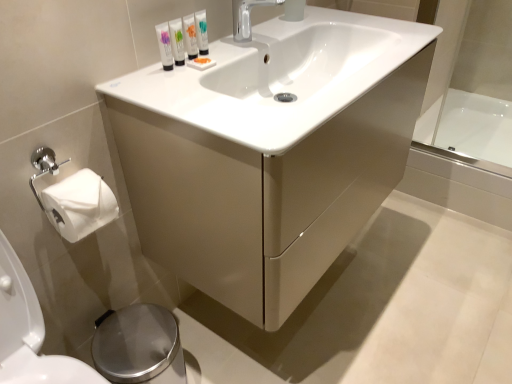
Question: Considering the relative sizes of polished stainless steel bidet at lower left and white glossy bathtub at right in the image provided, is polished stainless steel bidet at lower left taller than white glossy bathtub at right?

Choices:
 (A) yes
 (B) no

Answer: (A)

Question: Is polished stainless steel bidet at lower left closer to the viewer compared to white glossy bathtub at right?

Choices:
 (A) no
 (B) yes

Answer: (B)

Question: Is polished stainless steel bidet at lower left to the right of white glossy bathtub at right from the viewer's perspective?

Choices:
 (A) no
 (B) yes

Answer: (A)

Question: Does polished stainless steel bidet at lower left have a lesser width compared to white glossy bathtub at right?

Choices:
 (A) no
 (B) yes

Answer: (B)

Question: Does polished stainless steel bidet at lower left have a smaller size compared to white glossy bathtub at right?

Choices:
 (A) yes
 (B) no

Answer: (A)

Question: Is polished stainless steel bidet at lower left shorter than white glossy bathtub at right?

Choices:
 (A) yes
 (B) no

Answer: (B)

Question: Is matte white cabinet at center shorter than white glossy bathtub at right?

Choices:
 (A) no
 (B) yes

Answer: (A)

Question: From a real-world perspective, is matte white cabinet at center over white glossy bathtub at right?

Choices:
 (A) no
 (B) yes

Answer: (B)

Question: Are matte white cabinet at center and white glossy bathtub at right located far from each other?

Choices:
 (A) no
 (B) yes

Answer: (B)

Question: From the image's perspective, is matte white cabinet at center under white glossy bathtub at right?

Choices:
 (A) yes
 (B) no

Answer: (A)

Question: Is white glossy bathtub at right at the back of matte white cabinet at center?

Choices:
 (A) no
 (B) yes

Answer: (A)

Question: Considering the relative positions of matte white cabinet at center and white glossy bathtub at right in the image provided, is matte white cabinet at center behind white glossy bathtub at right?

Choices:
 (A) yes
 (B) no

Answer: (B)

Question: Is white glossy tube at upper center, which is the 4th mouthwash in left-to-right order, bigger than translucent plastic tubes at upper center, the second mouthwash from the left?

Choices:
 (A) no
 (B) yes

Answer: (A)